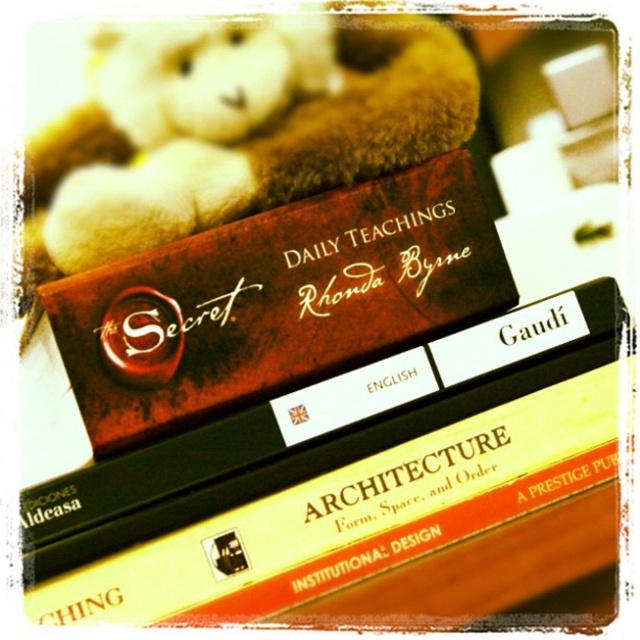
You are organizing a bookshelf and need to place the hardcover book at upper center and the matte brown book at center. According to the image, which book should be placed higher on the shelf?

The matte brown book at center should be placed higher on the shelf because the hardcover book at upper center is located below it in the image.

You are standing in front of the stack of books on the wooden surface. There are two points marked on the image. The first point is at coordinates point (371, 438) and the second is at point (346, 282). Which point is closer to you?

Point (371, 438) is in front of point (346, 282), so the first point is closer to you.